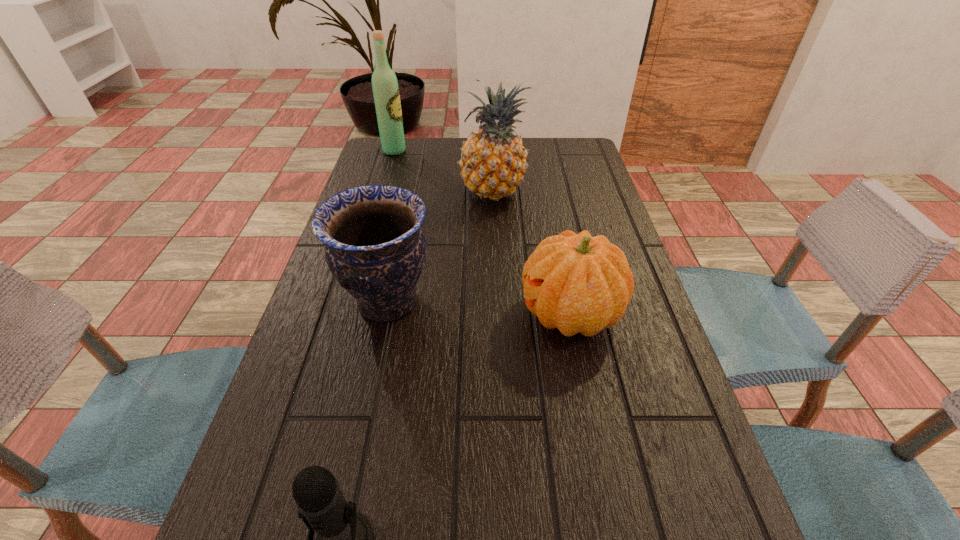
The height and width of the screenshot is (540, 960). Identify the location of the farthest object. (385, 87).

At what (x,y) coordinates should I click in order to perform the action: click on pineapple. Please return your answer as a coordinate pair (x, y). Looking at the image, I should click on (493, 161).

This screenshot has height=540, width=960. I want to click on the fourth nearest object, so click(x=493, y=161).

What are the coordinates of `pottery` in the screenshot? It's located at (375, 248).

Locate an element on the screen. This screenshot has height=540, width=960. pumpkin is located at coordinates point(574,282).

Find the location of a particular element. blank space located on the front-facing side of the farthest object is located at coordinates [499, 151].

This screenshot has height=540, width=960. I want to click on free region located 0.320m on the front of the fourth nearest object, so click(496, 295).

This screenshot has width=960, height=540. I want to click on vacant space located 0.150m on the front handle of the pottery, so click(504, 302).

Identify the location of vacant space located 0.070m on the carved face of the pumpkin. This screenshot has width=960, height=540. (488, 313).

I want to click on free space located 0.180m on the carved face of the pumpkin, so pyautogui.click(x=436, y=313).